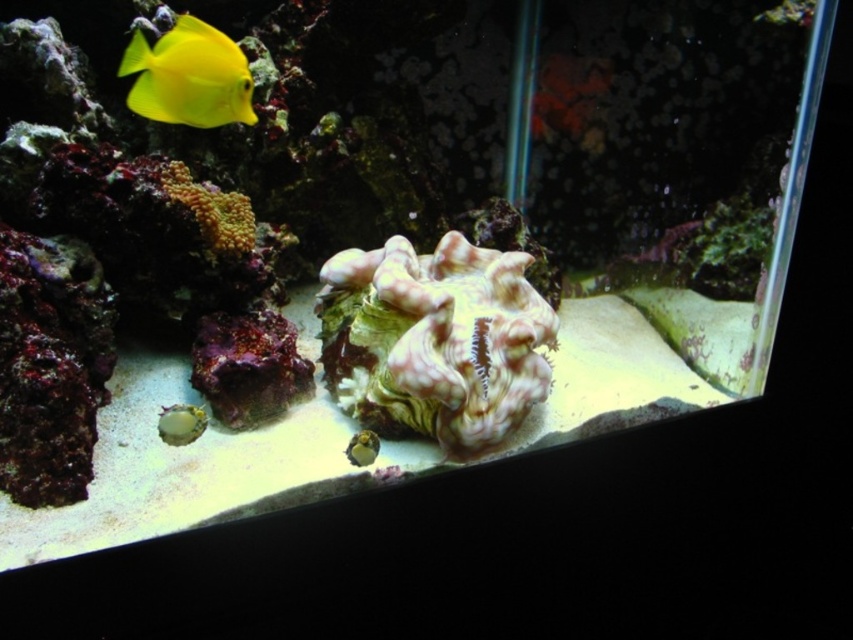
Question: Considering the relative positions of translucent yellowish-green shell at lower left and shiny yellow fish at lower center in the image provided, where is translucent yellowish-green shell at lower left located with respect to shiny yellow fish at lower center?

Choices:
 (A) below
 (B) above

Answer: (B)

Question: Does translucent yellowish-green shell at lower left appear over shiny yellow fish at lower center?

Choices:
 (A) yes
 (B) no

Answer: (A)

Question: Which point is closer to the camera?

Choices:
 (A) yellow matte fish at upper left
 (B) pinkish-white coral at center
 (C) translucent yellowish-green shell at lower left
 (D) shiny yellow fish at lower center

Answer: (A)

Question: Where is yellow matte fish at upper left located in relation to translucent yellowish-green shell at lower left in the image?

Choices:
 (A) left
 (B) right

Answer: (A)

Question: Which object is positioned farthest from the yellow matte fish at upper left?

Choices:
 (A) shiny yellow fish at lower center
 (B) pinkish-white coral at center
 (C) translucent yellowish-green shell at lower left

Answer: (A)

Question: Which object is the farthest from the pinkish-white coral at center?

Choices:
 (A) shiny yellow fish at lower center
 (B) translucent yellowish-green shell at lower left
 (C) yellow matte fish at upper left

Answer: (C)